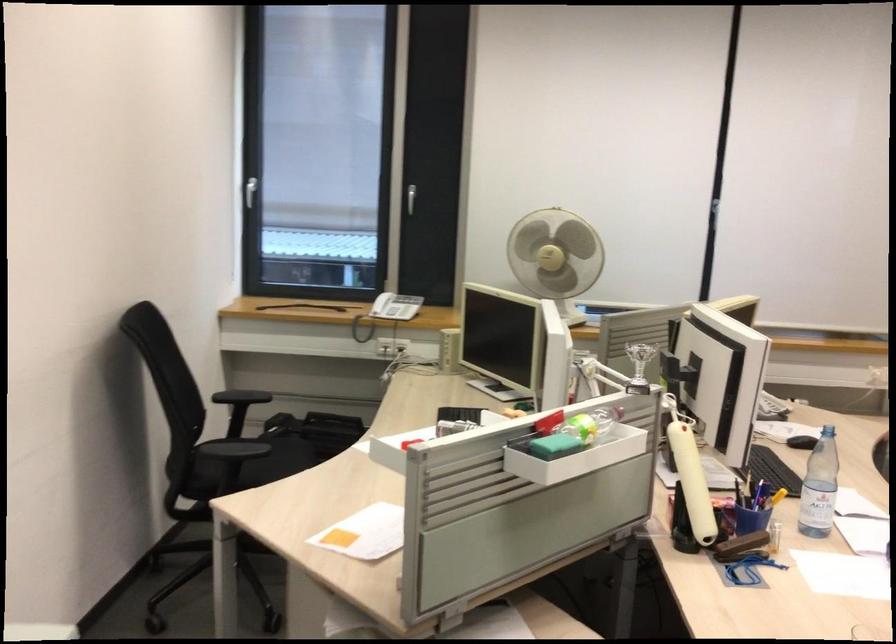
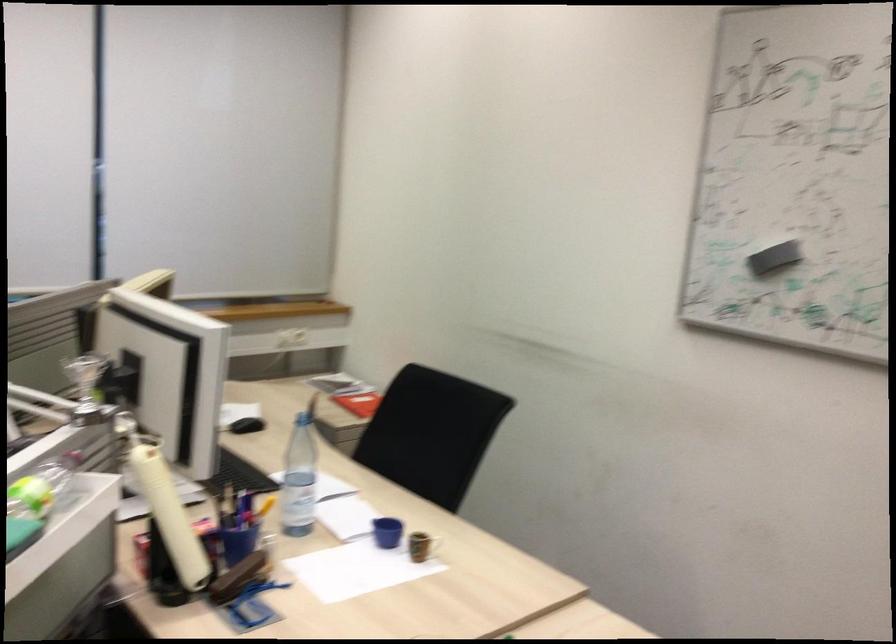
Question: The camera is either moving clockwise (left) or counter-clockwise (right) around the object. The first image is from the beginning of the video and the second image is from the end. Is the camera moving left or right when shooting the video?

Choices:
 (A) Left
 (B) Right

Answer: (A)